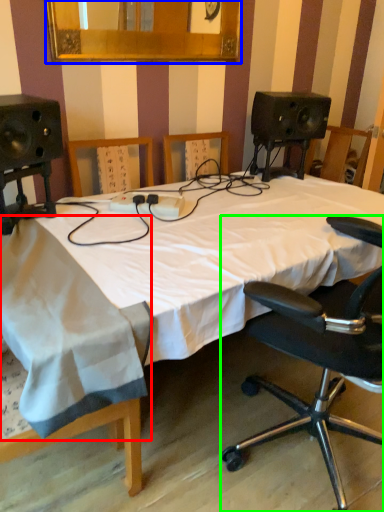
Question: Considering the real-world distances, which object is closest to sheet (highlighted by a red box)? mirror (highlighted by a blue box) or chair (highlighted by a green box).

Choices:
 (A) mirror
 (B) chair

Answer: (B)